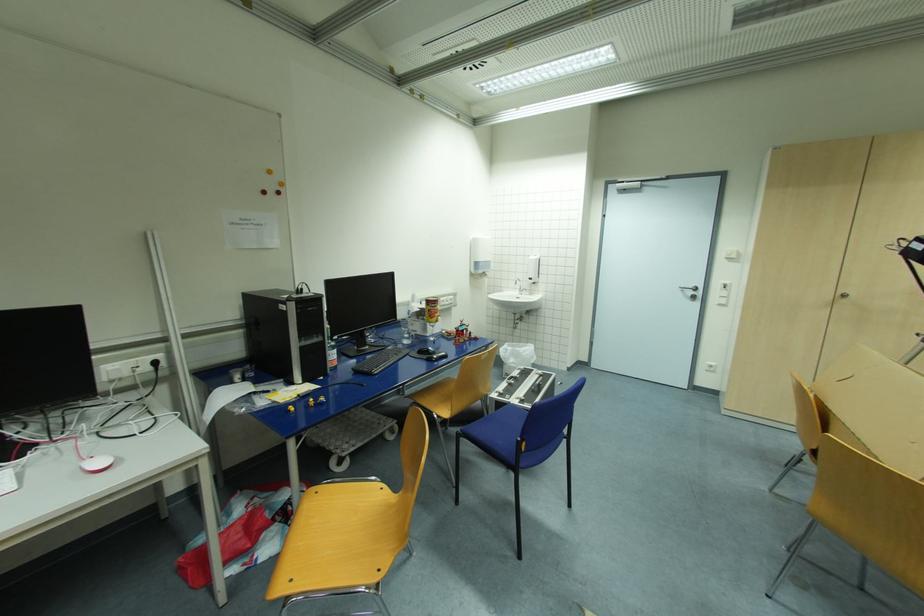
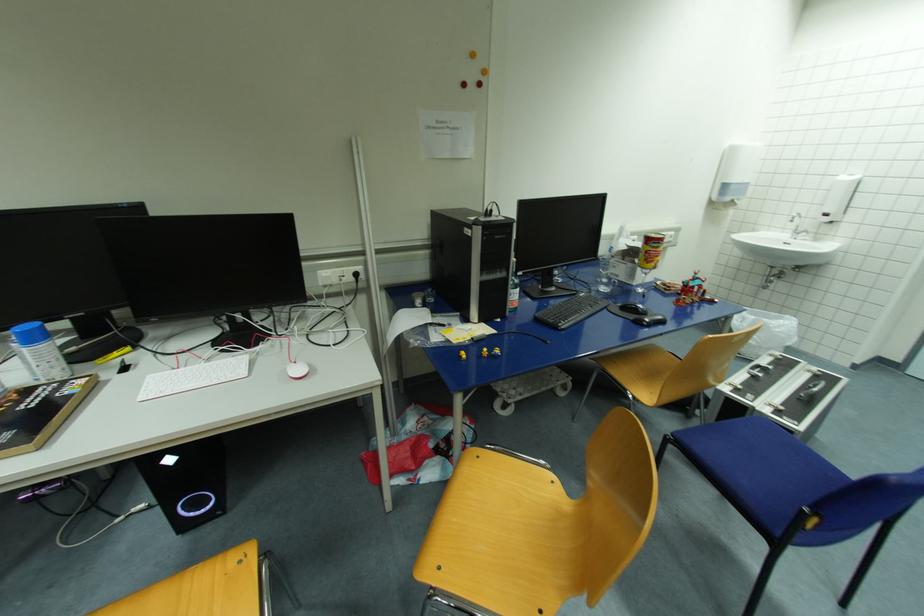
Find the pixel in the second image that matches pixel 438 358 in the first image.

(650, 321)